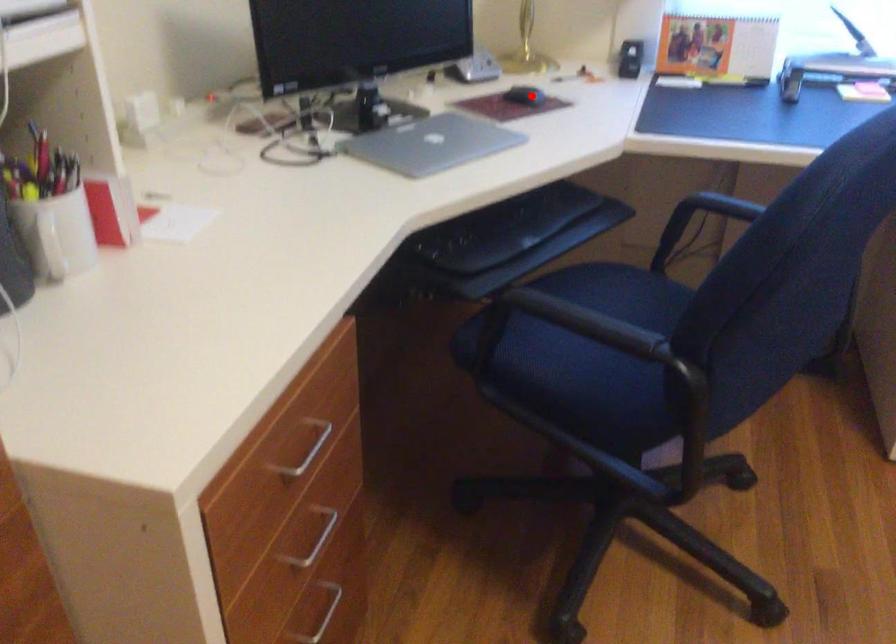
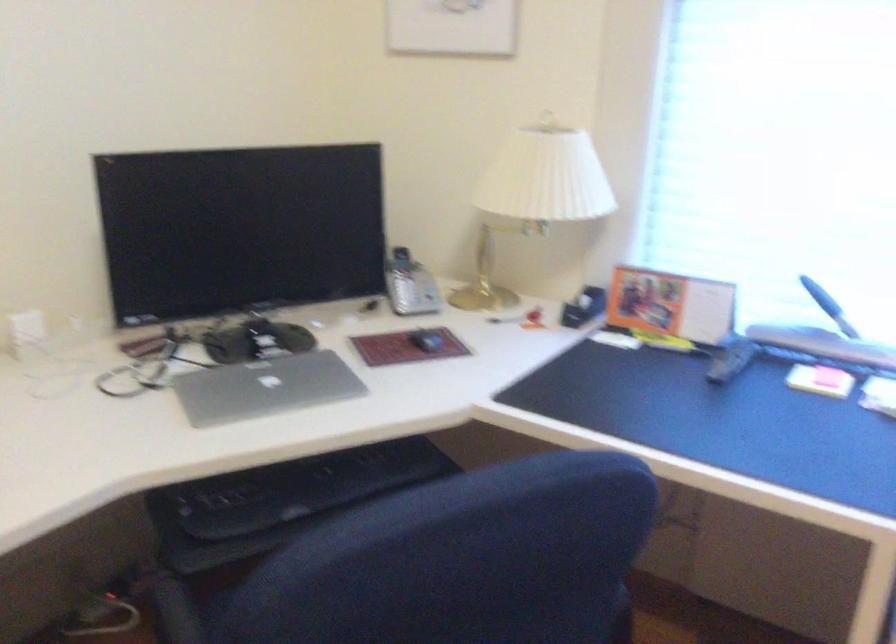
In the second image, find the point that corresponds to the highlighted location in the first image.

(426, 341)